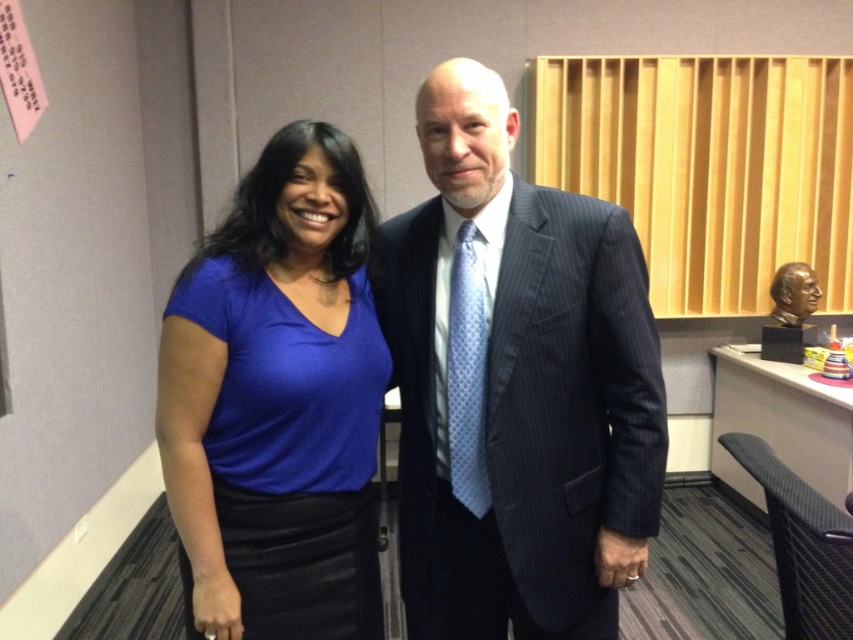
Does dark blue pinstripe suit at center appear under matte blue shirt at center?

No.

Does point (544, 432) come in front of point (247, 307)?

No, (544, 432) is behind (247, 307).

Find the location of a particular element. The image size is (853, 640). dark blue pinstripe suit at center is located at coordinates (515, 385).